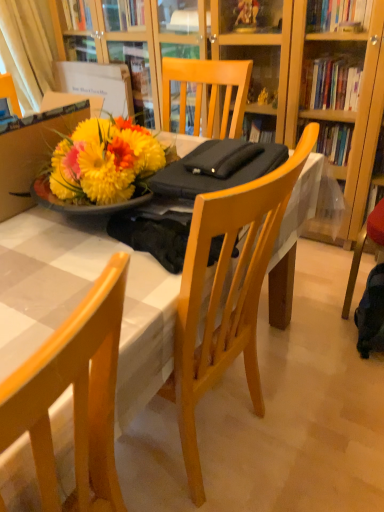
Question: Is point (64, 402) positioned closer to the camera than point (49, 466)?

Choices:
 (A) farther
 (B) closer

Answer: (A)

Question: Considering the relative positions of white glossy table at center and wooden chair at center in the image provided, is white glossy table at center to the left or to the right of wooden chair at center?

Choices:
 (A) left
 (B) right

Answer: (B)

Question: Which object is positioned closest to the dark blue fabric backpack at lower right?

Choices:
 (A) wooden chair at center
 (B) white glossy table at center
 (C) white fabric curtain at upper left

Answer: (B)

Question: Which object is positioned farthest from the white fabric curtain at upper left?

Choices:
 (A) wooden chair at center
 (B) dark blue fabric backpack at lower right
 (C) white glossy table at center

Answer: (A)